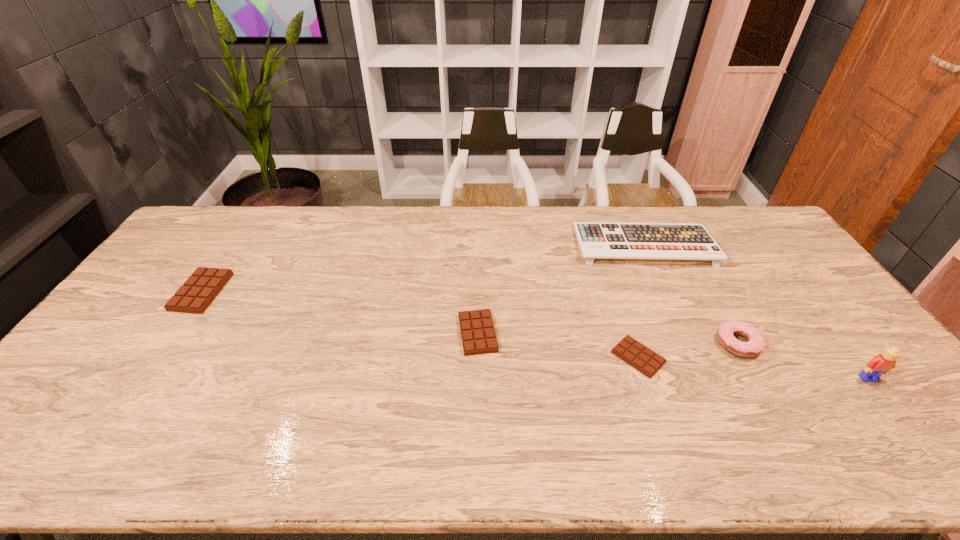
Image resolution: width=960 pixels, height=540 pixels. What are the coordinates of `blank area in the image that satisfies the following two spatial constraints: 1. on the back side of the rightmost candy bar; 2. on the right side of the computer keyboard` in the screenshot? It's located at point(601,245).

Locate an element on the screen. This screenshot has height=540, width=960. free space in the image that satisfies the following two spatial constraints: 1. on the back side of the shortest object; 2. on the right side of the doughnut is located at coordinates (634, 344).